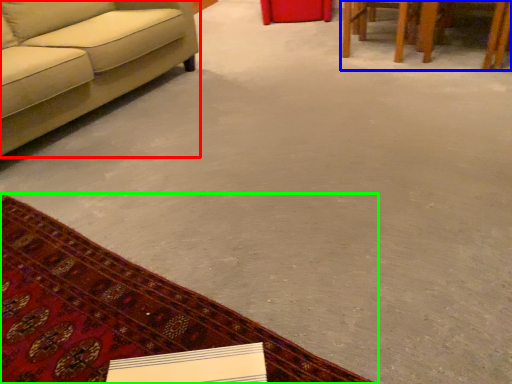
Question: Which object is the farthest from studio couch (highlighted by a red box)? Choose among these: table (highlighted by a blue box) or mat (highlighted by a green box).

Choices:
 (A) table
 (B) mat

Answer: (A)